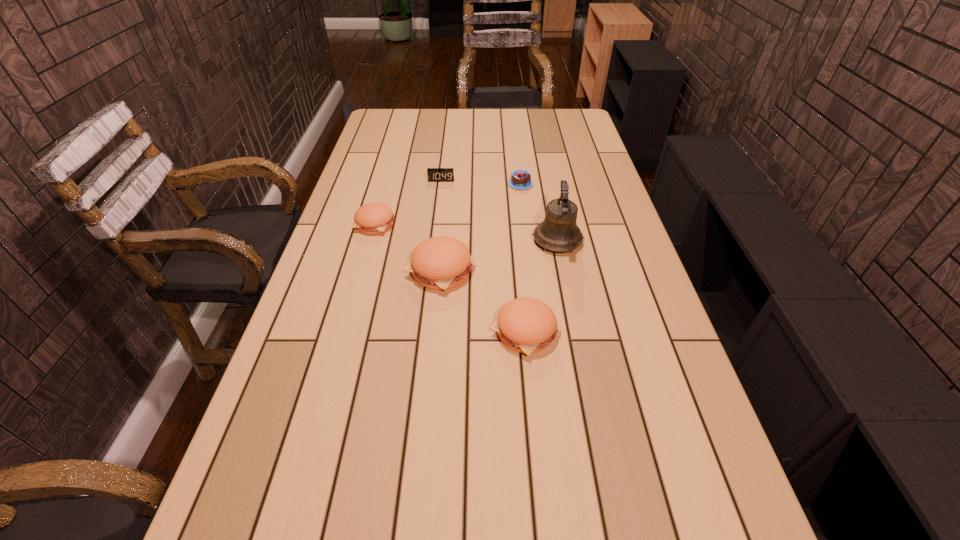
Please point a free position for a patty on the right. Please provide its 2D coordinates. Your answer should be formatted as a tuple, i.e. [(x, y)], where the tuple contains the x and y coordinates of a point satisfying the conditions above.

[(637, 413)]